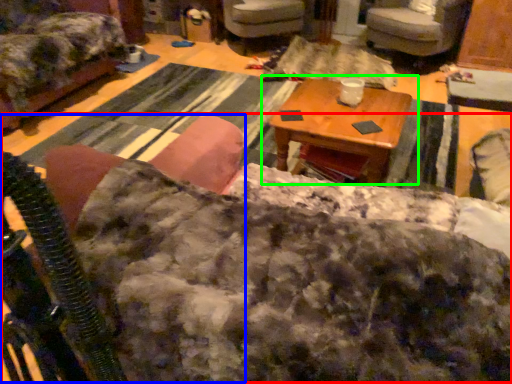
Question: Estimate the real-world distances between objects in this image. Which object is closer to couch (highlighted by a red box), rocking chair (highlighted by a blue box) or table (highlighted by a green box)?

Choices:
 (A) rocking chair
 (B) table

Answer: (A)